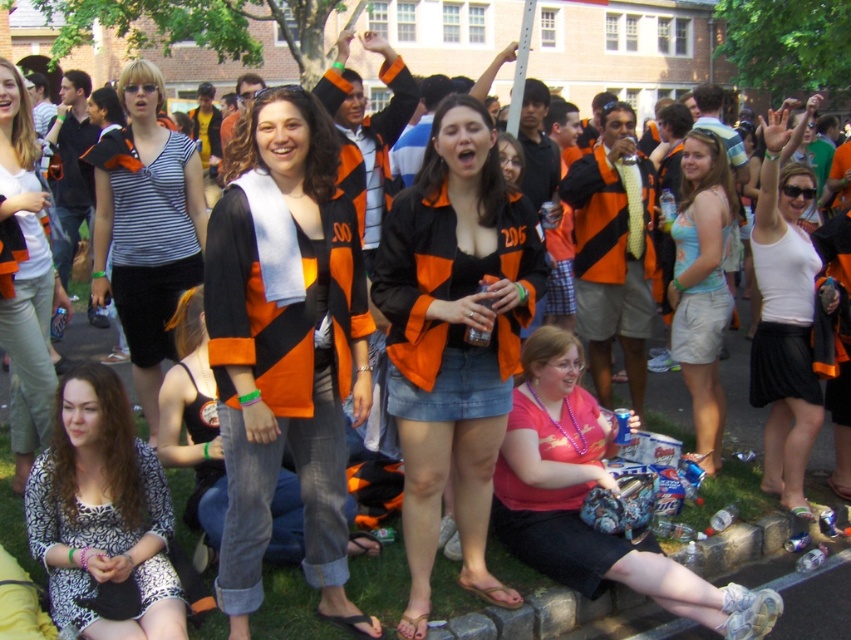
You are a photographer at the event and want to ensure both the pink matte shirt at lower center and the light blue denim shorts at center are clearly visible in your photo. Given their sizes, which object should you focus on first to ensure proper framing?

The pink matte shirt at lower center is larger in size than the light blue denim shorts at center, so focusing on the pink matte shirt at lower center first will ensure proper framing due to its larger size.

What is the 2D coordinate of the printed fabric dress at lower left in the image?

The printed fabric dress at lower left is located at the 2D coordinate point of (101, 513).

Consider the image. You are a photographer at the event and want to take a photo of both the printed fabric dress at lower left and the white cotton shirt at center. However, you have a limited frame size. Which clothing item should you adjust your focus on to ensure both are fully visible?

The printed fabric dress at lower left is shorter than the white cotton shirt at center. To ensure both are fully visible, focus on the taller white cotton shirt at center while adjusting the frame to accommodate the shorter printed fabric dress at lower left.